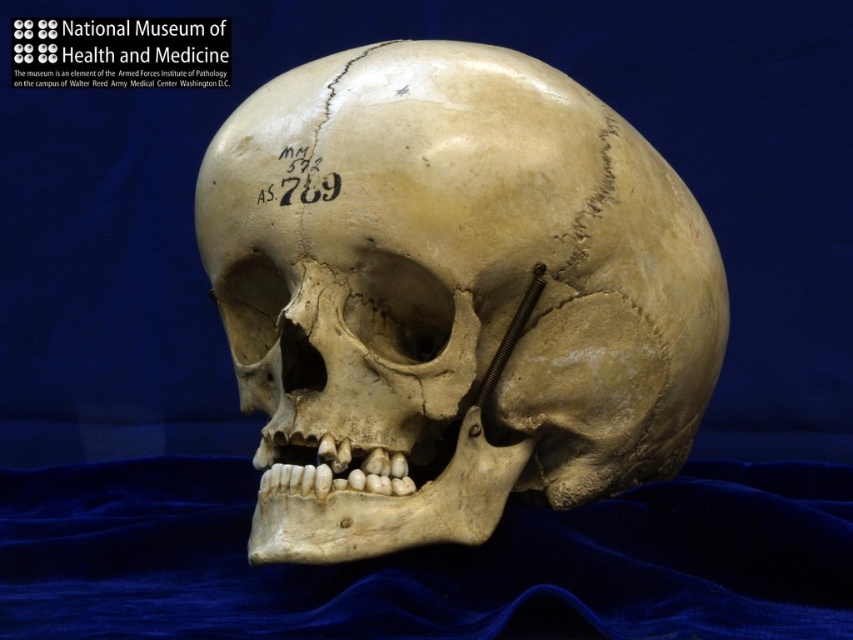
You are an art curator arranging an exhibition. You need to ensure that the matte bone skull at center is visible without obstruction from the white paper text at upper left. Based on their positions, is this possible?

The matte bone skull at center is positioned under the white paper text at upper left, so part of the skull may be obscured by the text. To ensure visibility, adjust the text or skull placement so they are not overlapping vertically.

You are an art curator preparing an exhibition. You need to ensure that the matte bone skull at center does not overshadow the white paper text at upper left. Based on the scene description, is the current size relationship between them appropriate for visibility of both elements?

The matte bone skull at center is larger in size than the white paper text at upper left. This size difference may cause the white paper text at upper left to be less noticeable, making the current arrangement inappropriate for ensuring both elements are clearly visible.

You are a museum curator arranging an exhibit. You need to place a label next to the matte bone skull at center so visitors can read it easily. The label must be within 8 inches of the skull. Can the black ink label at center be placed in the correct position?

The matte bone skull at center and black ink label at center are 7.37 inches apart from each other, which is within the 8 inch requirement. Therefore, the black ink label at center can be placed in the correct position.